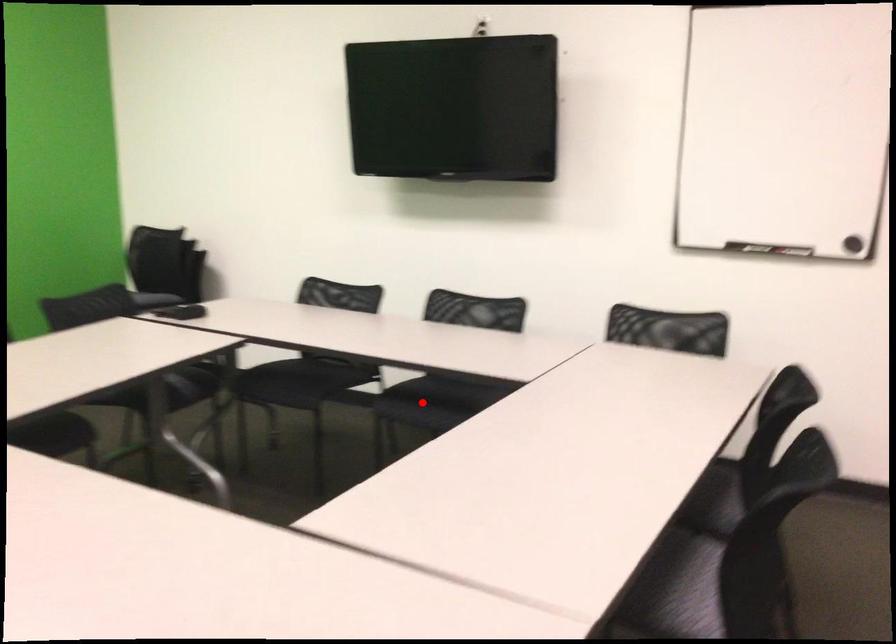
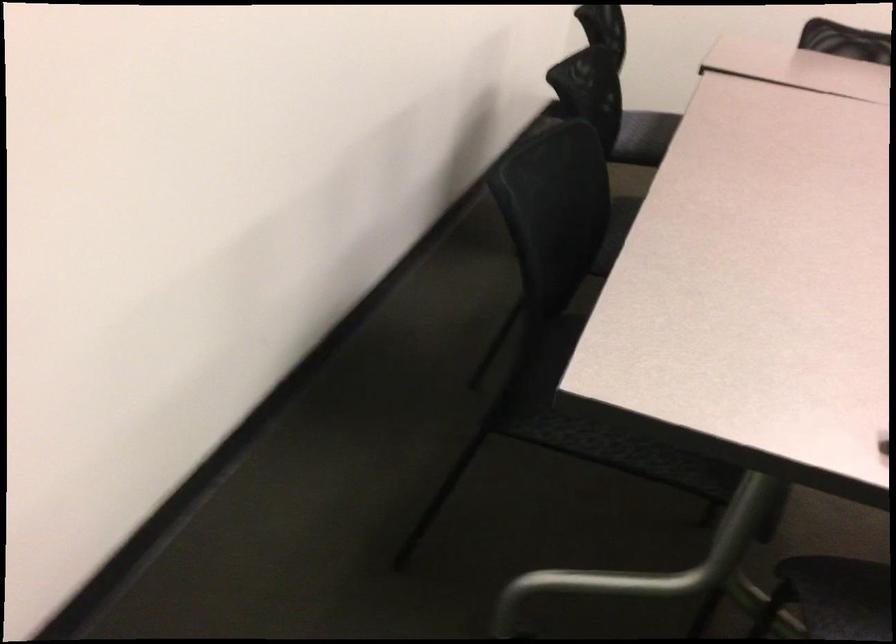
Question: I am providing you with two images of the same scene from different viewpoints. A red point is marked on the first image. Is the red point's position out of view in image 2?

Choices:
 (A) Yes
 (B) No

Answer: (A)